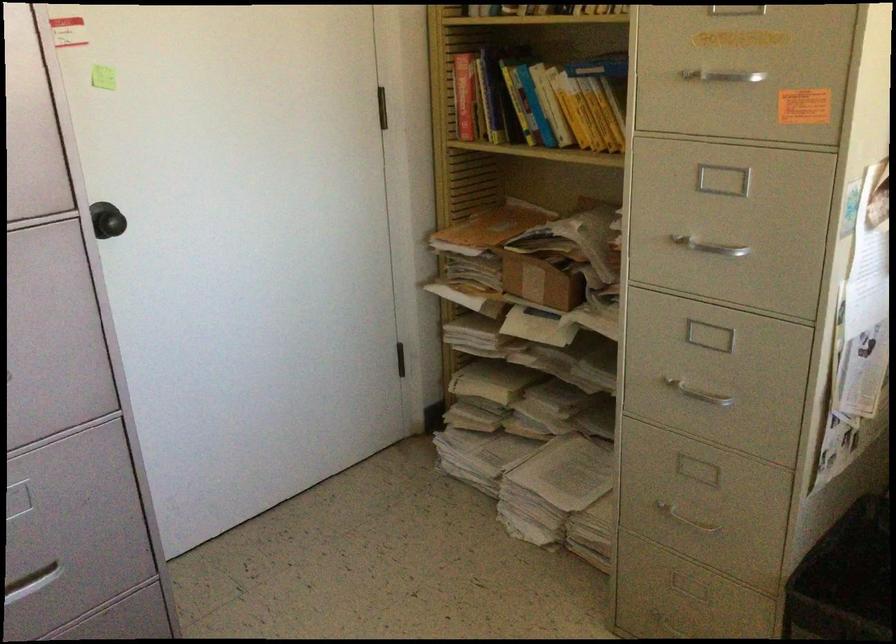
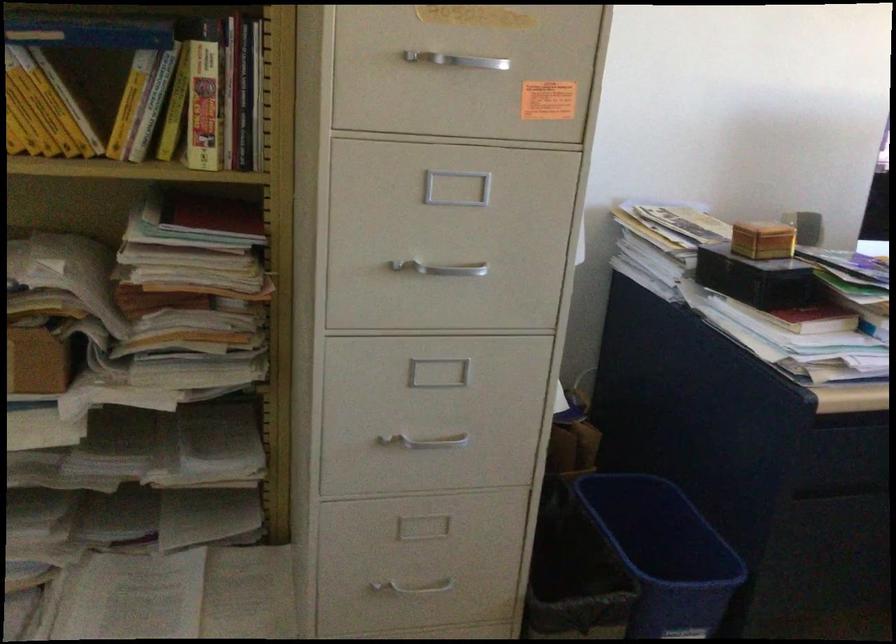
Question: The camera is either moving clockwise (left) or counter-clockwise (right) around the object. The first image is from the beginning of the video and the second image is from the end. Is the camera moving left or right when shooting the video?

Choices:
 (A) Left
 (B) Right

Answer: (A)